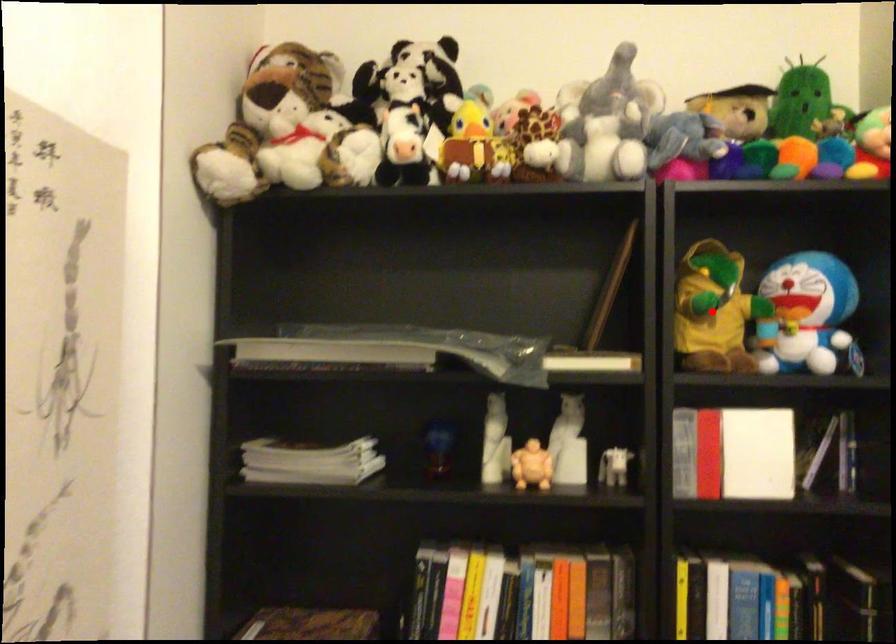
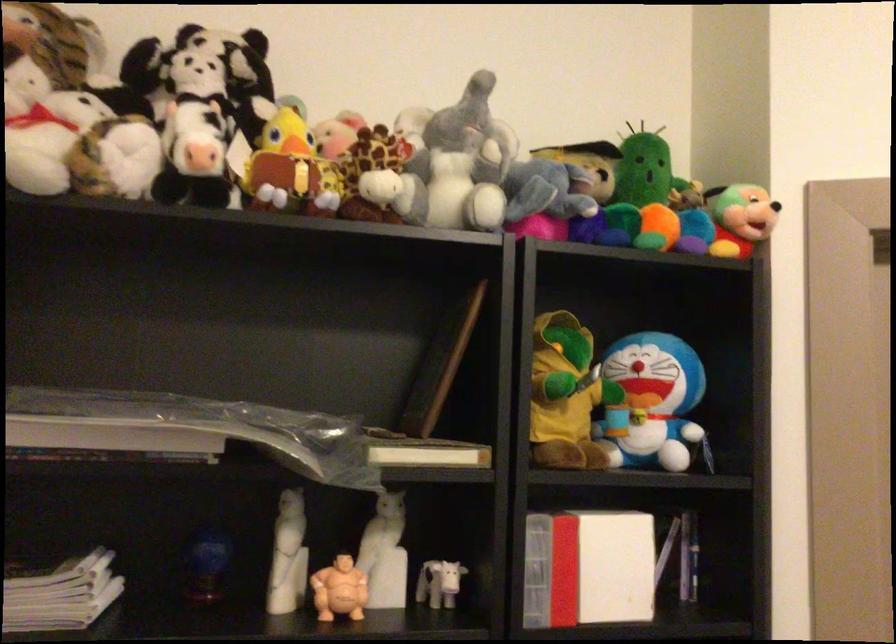
In the second image, find the point that corresponds to the highlighted location in the first image.

(565, 395)